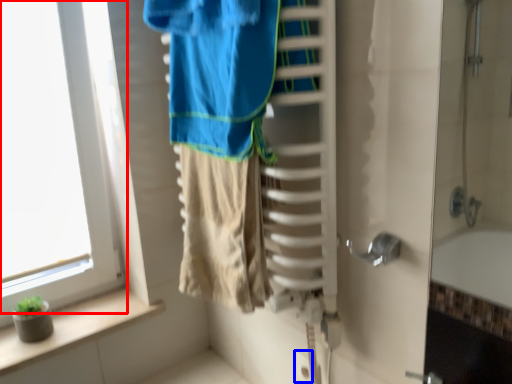
Question: Which object is further to the camera taking this photo, window (highlighted by a red box) or electric outlet (highlighted by a blue box)?

Choices:
 (A) window
 (B) electric outlet

Answer: (B)